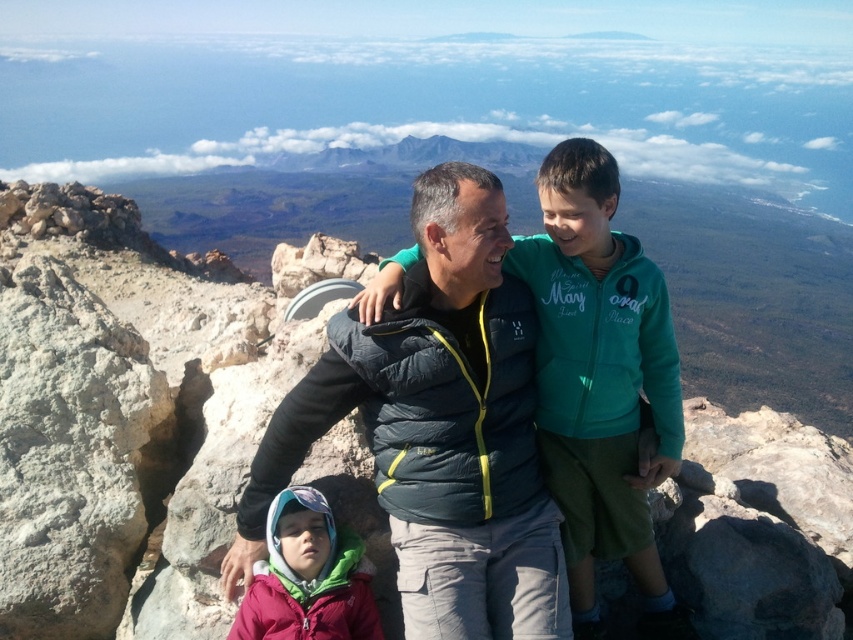
You are a hiker planning to set up a tent between the dark blue down jacket at center and the teal fleece jacket at center. The tent requires a minimum of 2 meters of space to be set up properly. Based on the scene, is there enough space between them to set up the tent?

The dark blue down jacket at center and the teal fleece jacket at center are 1.96 meters apart. Since the required space is 2 meters, there is insufficient space to set up the tent properly between them.

You are planning to take a photo of the teal fleece jacket at center and the matte pink jacket at lower left. Which jacket should you focus on first if you want to include both in the frame without moving the camera?

You should focus on the teal fleece jacket at center first because it is much taller than the matte pink jacket at lower left, so it will occupy more space in the frame and ensure both are visible.

You are standing on the rocky outcrop and want to take a photo of both the teal fleece jacket at center and the matte pink jacket at lower left. Which person should you focus on first to ensure both are in the frame?

You should focus on the teal fleece jacket at center first because it is closer to you than the matte pink jacket at lower left, ensuring both are in the frame.